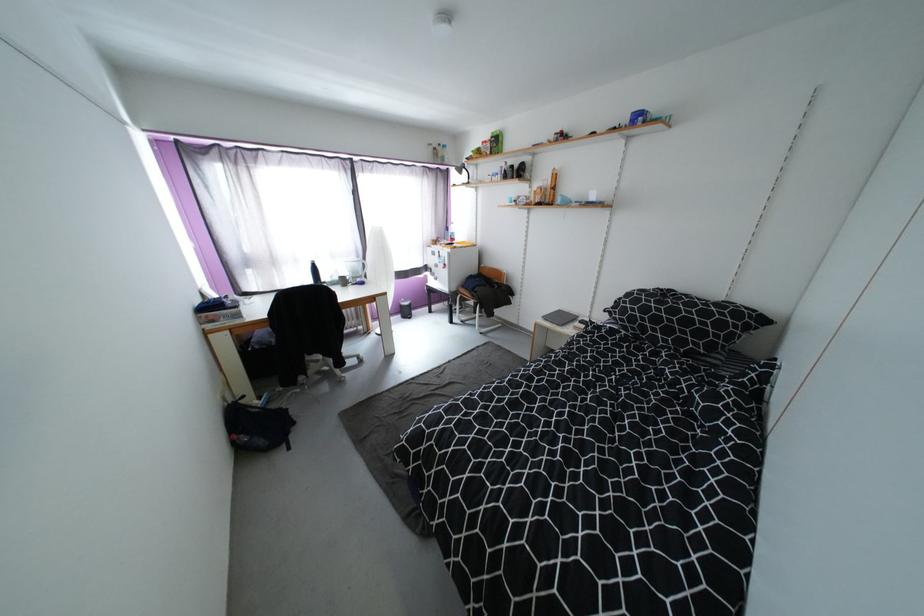
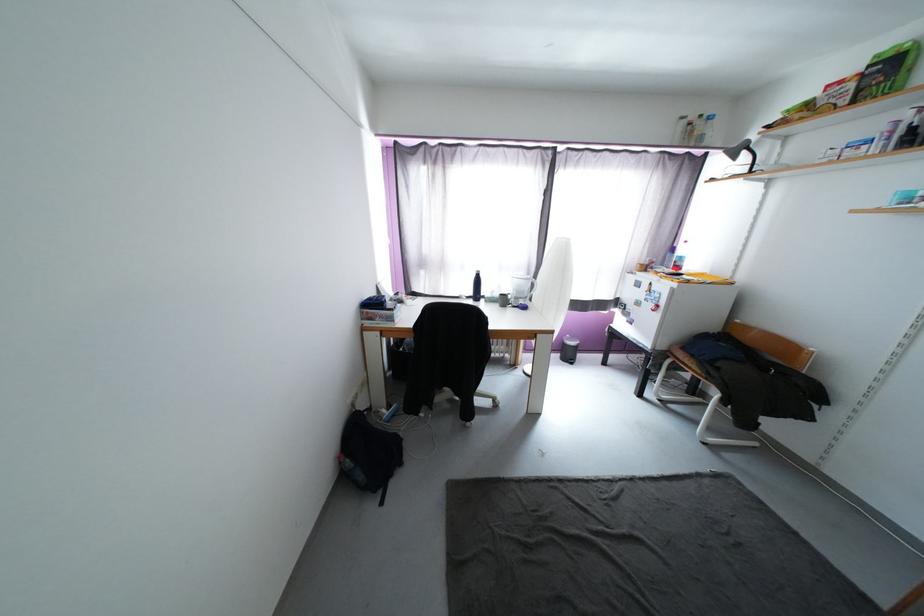
Find the pixel in the second image that matches [342,280] in the first image.

(503, 296)